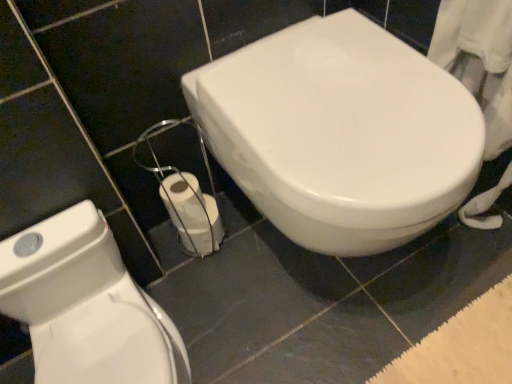
Question: Which direction should I rotate to look at white glossy toilet at center, the 2th toilet from the left?

Choices:
 (A) right
 (B) left

Answer: (A)

Question: Is the position of white glossy toilet at lower left, acting as the 1th toilet starting from the left, less distant than that of white matte toilet paper at lower center?

Choices:
 (A) yes
 (B) no

Answer: (A)

Question: Can you confirm if white glossy toilet at lower left, the 2th toilet when ordered from right to left, is wider than white matte toilet paper at lower center?

Choices:
 (A) yes
 (B) no

Answer: (A)

Question: Considering the relative sizes of white glossy toilet at lower left, the 2th toilet when ordered from right to left, and white matte toilet paper at lower center in the image provided, is white glossy toilet at lower left, the 2th toilet when ordered from right to left, thinner than white matte toilet paper at lower center?

Choices:
 (A) yes
 (B) no

Answer: (B)

Question: Does white glossy toilet at lower left, acting as the 1th toilet starting from the left, touch white matte toilet paper at lower center?

Choices:
 (A) no
 (B) yes

Answer: (A)

Question: Considering the relative sizes of white glossy toilet at lower left, acting as the 1th toilet starting from the left, and white matte toilet paper at lower center in the image provided, is white glossy toilet at lower left, acting as the 1th toilet starting from the left, bigger than white matte toilet paper at lower center?

Choices:
 (A) no
 (B) yes

Answer: (B)

Question: Considering the relative sizes of white glossy toilet at lower left, acting as the 1th toilet starting from the left, and white matte toilet paper at lower center in the image provided, is white glossy toilet at lower left, acting as the 1th toilet starting from the left, smaller than white matte toilet paper at lower center?

Choices:
 (A) no
 (B) yes

Answer: (A)

Question: Is the position of white glossy toilet at center, acting as the 1th toilet starting from the right, less distant than that of white matte toilet paper at lower center?

Choices:
 (A) yes
 (B) no

Answer: (A)

Question: Is white glossy toilet at center, the 2th toilet from the left, shorter than white matte toilet paper at lower center?

Choices:
 (A) yes
 (B) no

Answer: (B)

Question: Can you confirm if white glossy toilet at center, acting as the 1th toilet starting from the right, is wider than white matte toilet paper at lower center?

Choices:
 (A) yes
 (B) no

Answer: (A)

Question: Is white glossy toilet at center, the 2th toilet from the left, located outside white matte toilet paper at lower center?

Choices:
 (A) yes
 (B) no

Answer: (A)

Question: Considering the relative sizes of white glossy toilet at center, acting as the 1th toilet starting from the right, and white matte toilet paper at lower center in the image provided, is white glossy toilet at center, acting as the 1th toilet starting from the right, bigger than white matte toilet paper at lower center?

Choices:
 (A) yes
 (B) no

Answer: (A)

Question: Does white glossy toilet at center, the 2th toilet from the left, appear on the right side of white matte toilet paper at lower center?

Choices:
 (A) yes
 (B) no

Answer: (A)

Question: Can you confirm if white glossy toilet at lower left, acting as the 1th toilet starting from the left, is shorter than white glossy toilet at center, the 2th toilet from the left?

Choices:
 (A) yes
 (B) no

Answer: (A)